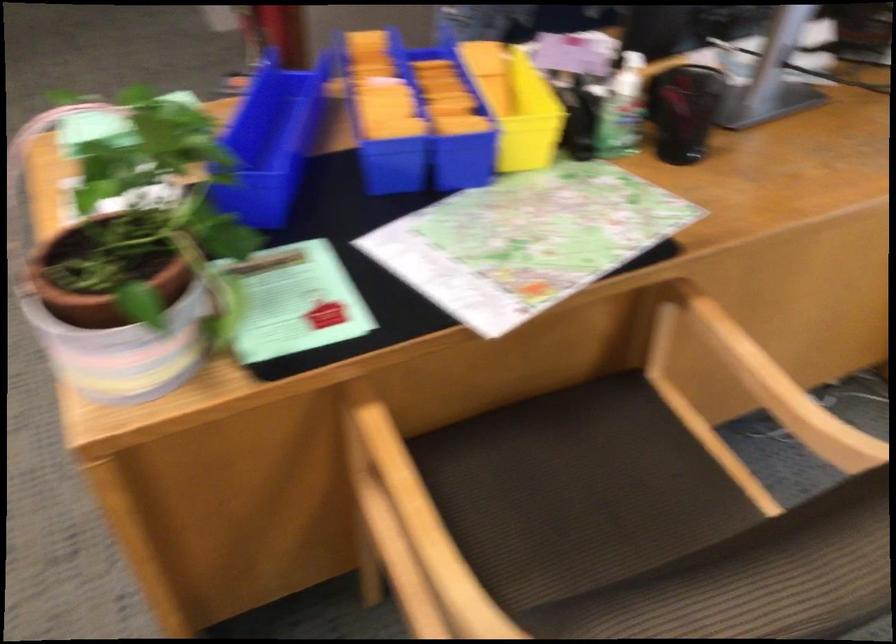
What do you see at coordinates (779, 388) in the screenshot? The width and height of the screenshot is (896, 644). I see `a chair armrest` at bounding box center [779, 388].